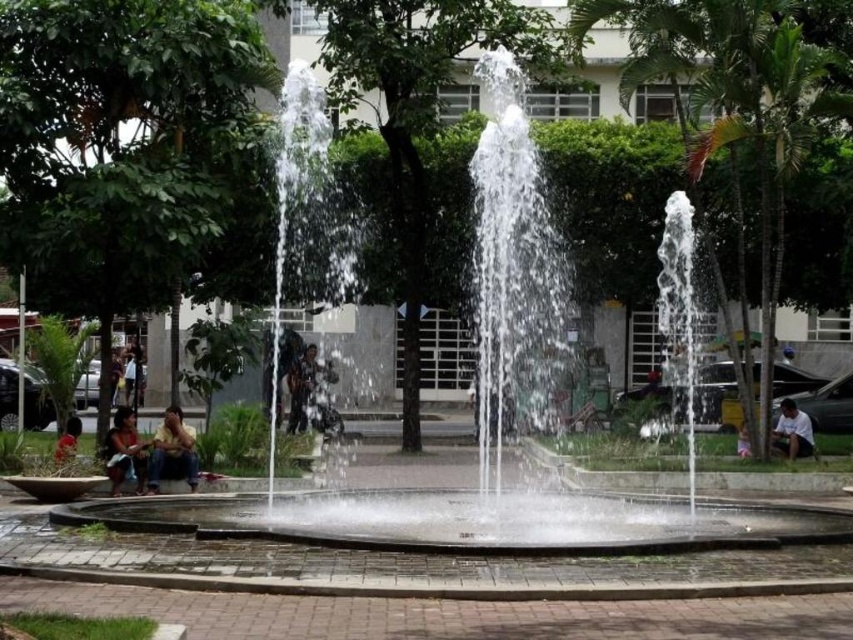
Question: Is yellow fabric shirt at lower left positioned at the back of dark brown leather jacket at center?

Choices:
 (A) yes
 (B) no

Answer: (B)

Question: Is yellow fabric shirt at lower left smaller than matte red shirt at lower left?

Choices:
 (A) yes
 (B) no

Answer: (B)

Question: Is yellow fabric shirt at lower left to the right of white fabric person at center from the viewer's perspective?

Choices:
 (A) no
 (B) yes

Answer: (A)

Question: Which of the following is the closest to the observer?

Choices:
 (A) matte brown shirt at lower left
 (B) white fabric person at center
 (C) matte red shirt at lower left
 (D) white cotton shirt at lower right

Answer: (A)

Question: Which point appears closest to the camera in this image?

Choices:
 (A) (746, 426)
 (B) (167, 461)
 (C) (55, 464)

Answer: (C)

Question: Which point is farther to the camera?

Choices:
 (A) white cotton shirt at lower right
 (B) dark brown leather jacket at center
 (C) matte brown shirt at lower left
 (D) yellow fabric shirt at lower left

Answer: (B)